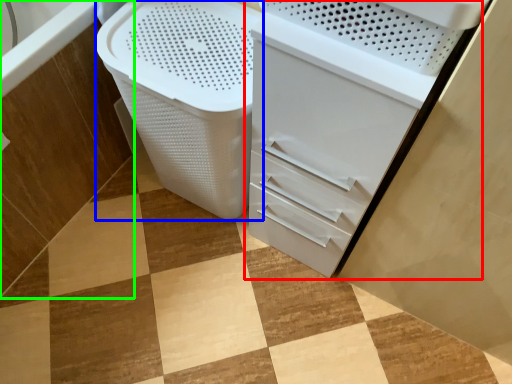
Question: Which object is positioned farthest from file cabinet (highlighted by a red box)? Select from laundry basket (highlighted by a blue box) and bath (highlighted by a green box).

Choices:
 (A) laundry basket
 (B) bath

Answer: (B)